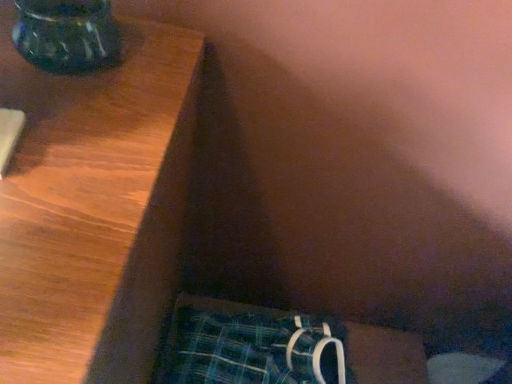
Question: Visually, is translucent glass vase at upper left positioned to the left or to the right of plaid fabric underwear at lower right?

Choices:
 (A) right
 (B) left

Answer: (B)

Question: From the image's perspective, is translucent glass vase at upper left above or below plaid fabric underwear at lower right?

Choices:
 (A) above
 (B) below

Answer: (A)

Question: In terms of height, does translucent glass vase at upper left look taller or shorter compared to plaid fabric underwear at lower right?

Choices:
 (A) tall
 (B) short

Answer: (B)

Question: In terms of width, does plaid fabric underwear at lower right look wider or thinner when compared to translucent glass vase at upper left?

Choices:
 (A) wide
 (B) thin

Answer: (A)

Question: In terms of height, does plaid fabric underwear at lower right look taller or shorter compared to translucent glass vase at upper left?

Choices:
 (A) short
 (B) tall

Answer: (B)

Question: Is plaid fabric underwear at lower right in front of or behind translucent glass vase at upper left in the image?

Choices:
 (A) behind
 (B) front

Answer: (A)

Question: Considering the relative positions of plaid fabric underwear at lower right and translucent glass vase at upper left in the image provided, is plaid fabric underwear at lower right to the left or to the right of translucent glass vase at upper left?

Choices:
 (A) right
 (B) left

Answer: (A)